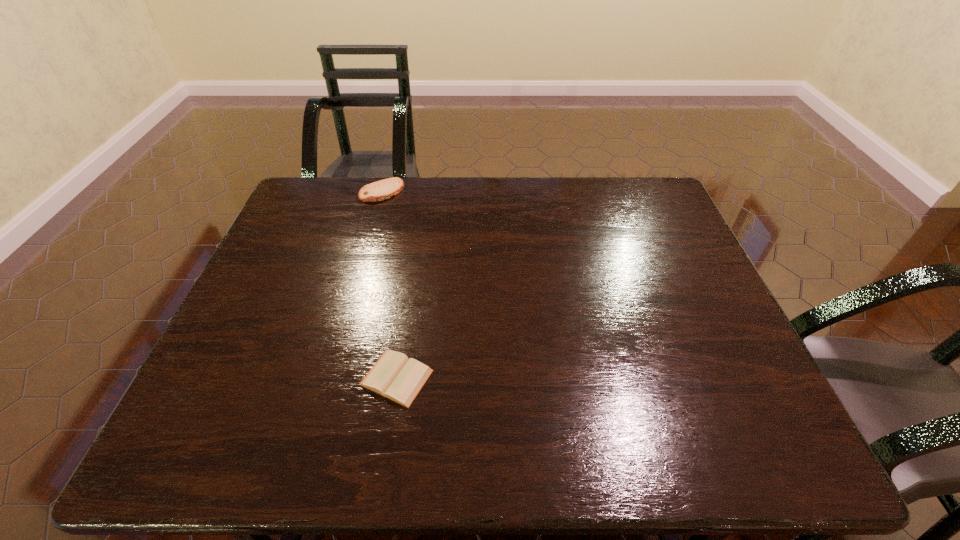
Find the location of a particular element. Image resolution: width=960 pixels, height=540 pixels. free region at the right edge of the desktop is located at coordinates (734, 379).

At what (x,y) coordinates should I click in order to perform the action: click on free space at the far left corner of the desktop. Please return your answer as a coordinate pair (x, y). The height and width of the screenshot is (540, 960). Looking at the image, I should click on (332, 212).

The width and height of the screenshot is (960, 540). What are the coordinates of `free region at the near left corner of the desktop` in the screenshot? It's located at (202, 451).

This screenshot has width=960, height=540. In order to click on vacant space at the far right corner of the desktop in this screenshot , I will do [636, 199].

Locate an element on the screen. vacant space that satisfies the following two spatial constraints: 1. on the front side of the pita bread; 2. on the left side of the diary is located at coordinates (330, 377).